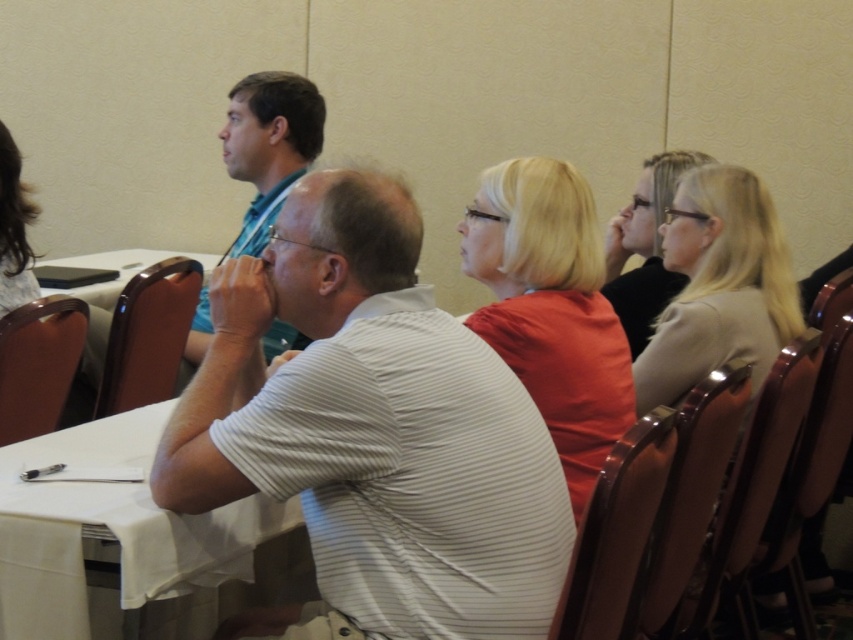
You are organizing a small event and need to place a decorative white cloth at lower left on the white plastic table at center. Based on the scene description, will the cloth fit entirely on the table?

The white cloth at lower left is narrower than the white plastic table at center, so it should fit entirely on the table.

You are standing at the entrance of the conference room and need to locate the person wearing the white striped shirt at center. According to the spatial coordinates provided, where should you look to find them?

The white striped shirt at center is located at point 0.669 on the horizontal axis and 0.440 on the vertical axis, so you should look towards the middle right area of the room since the coordinates indicate a position that is two thirds of the way across horizontally and slightly below the center vertically.